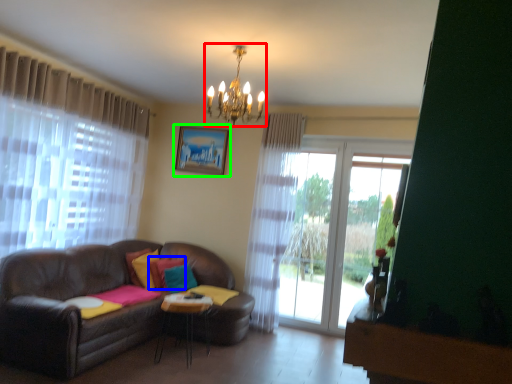
Question: Considering the real-world distances, which object is farthest from light fixture (highlighted by a red box)? pillow (highlighted by a blue box) or picture frame (highlighted by a green box)?

Choices:
 (A) pillow
 (B) picture frame

Answer: (A)